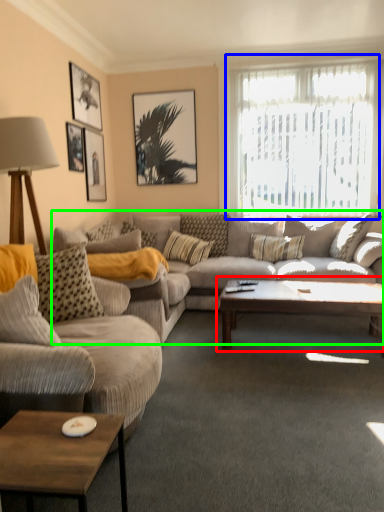
Question: Considering the real-world distances, which object is closest to coffee table (highlighted by a red box)? window (highlighted by a blue box) or studio couch (highlighted by a green box).

Choices:
 (A) window
 (B) studio couch

Answer: (B)